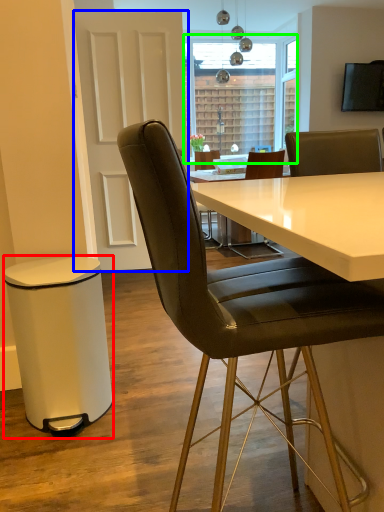
Question: Which is nearer to the bar stool (highlighted by a red box)? glass door (highlighted by a blue box) or window screen (highlighted by a green box).

Choices:
 (A) glass door
 (B) window screen

Answer: (A)